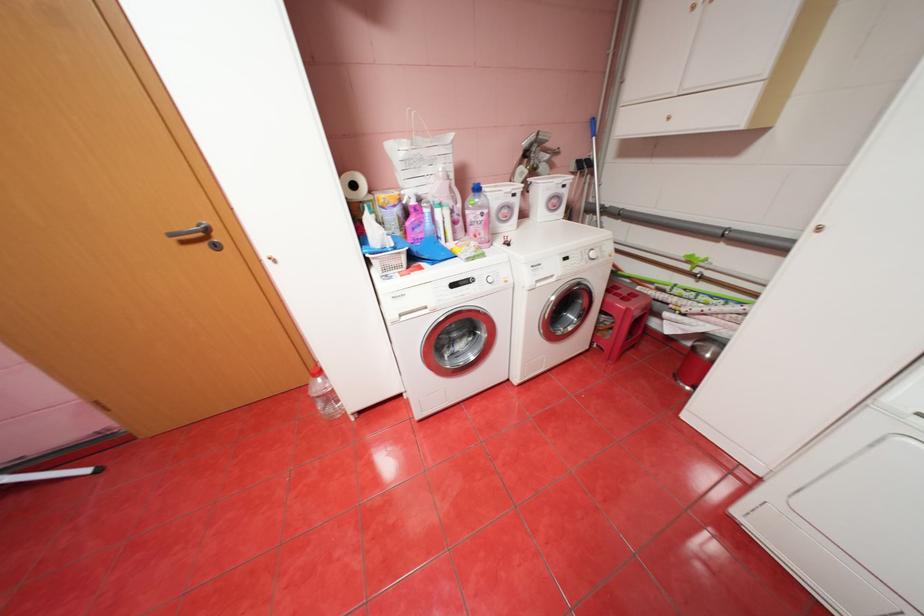
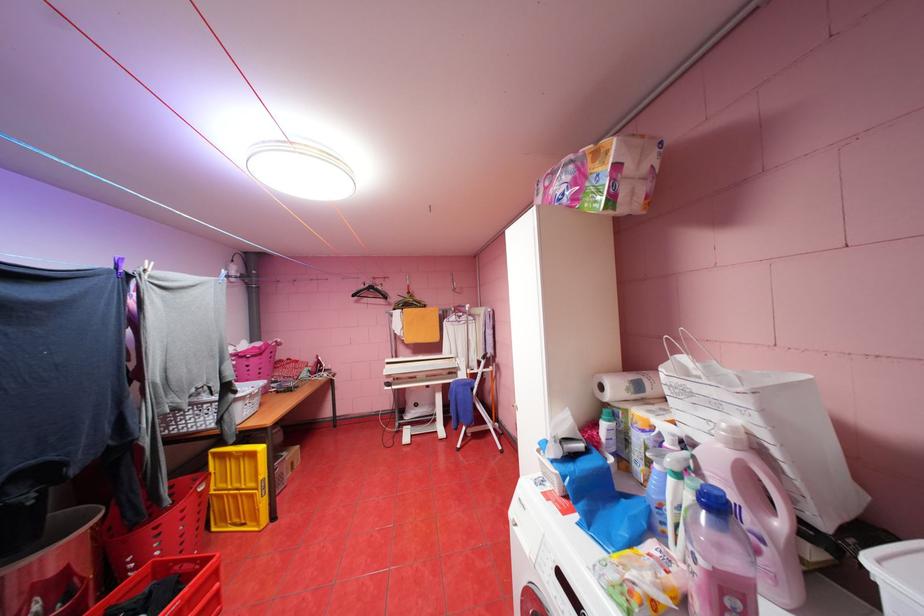
In the second image, find the point that corresponds to (x=459, y=155) in the first image.

(763, 413)